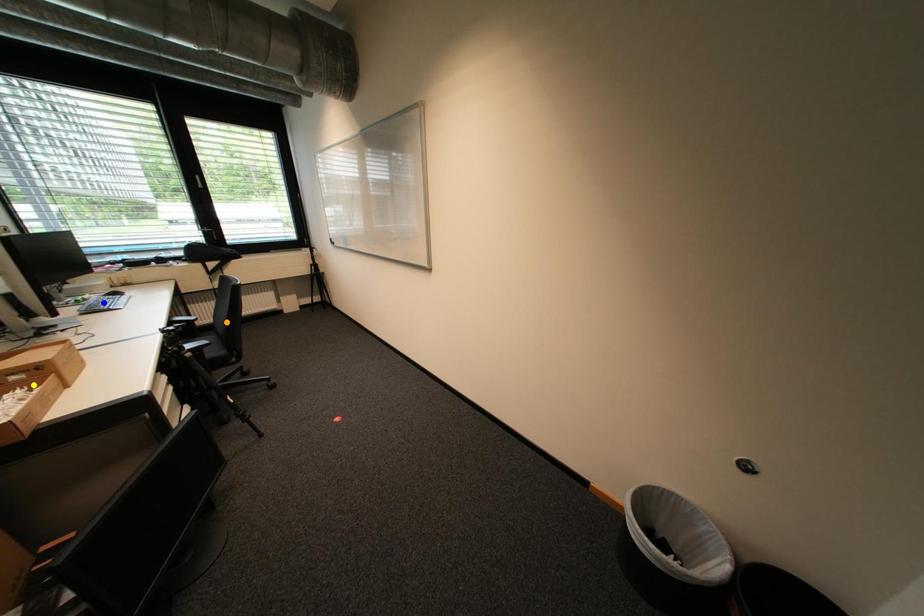
Order these from nearest to farthest:
orange point | yellow point | blue point

yellow point, blue point, orange point